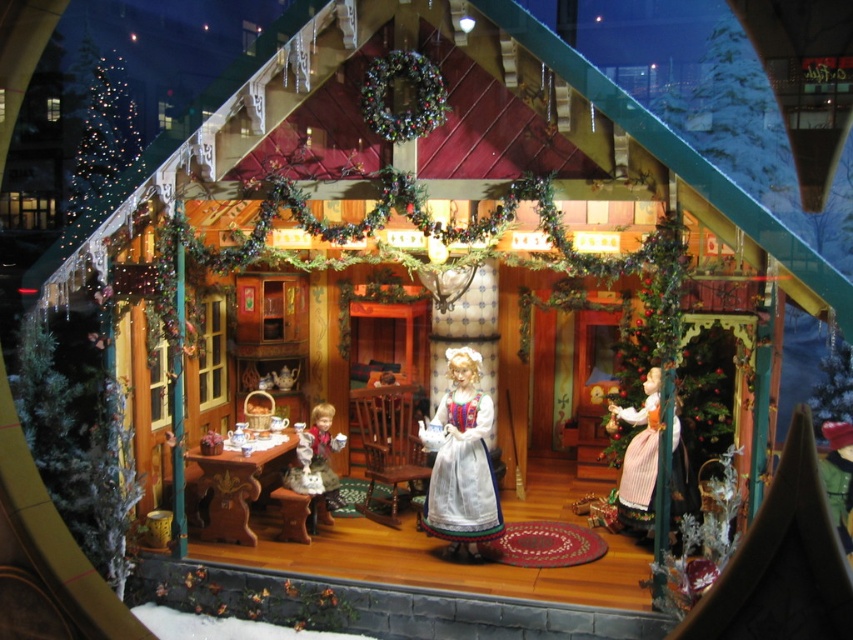
Who is lower down, white porcelain doll at center or porcelain doll at lower left?

porcelain doll at lower left is below.

Between point (440, 404) and point (331, 474), which one is positioned in front?

Positioned in front is point (440, 404).

Identify the location of white porcelain doll at center. The width and height of the screenshot is (853, 640). (463, 460).

Identify the location of white porcelain doll at center. (463, 460).

Who is positioned more to the left, matte white porcelain doll at right or porcelain doll at lower left?

porcelain doll at lower left is more to the left.

Who is more distant from viewer, (x=656, y=428) or (x=334, y=472)?

Point (x=334, y=472)

Which is behind, point (630, 465) or point (308, 460)?

The point (308, 460) is more distant.

At what (x,y) coordinates should I click in order to perform the action: click on matte white porcelain doll at right. Please return your answer as a coordinate pair (x, y). Looking at the image, I should click on 639,456.

Is white porcelain doll at center shorter than matte white porcelain doll at right?

No, white porcelain doll at center is not shorter than matte white porcelain doll at right.

This screenshot has height=640, width=853. Describe the element at coordinates (463, 460) in the screenshot. I see `white porcelain doll at center` at that location.

Where is `white porcelain doll at center`? white porcelain doll at center is located at coordinates (463, 460).